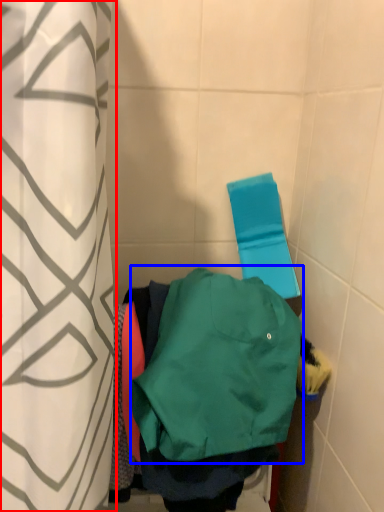
Question: Which point is further to the camera, curtain (highlighted by a red box) or sweatshirt (highlighted by a blue box)?

Choices:
 (A) curtain
 (B) sweatshirt

Answer: (B)